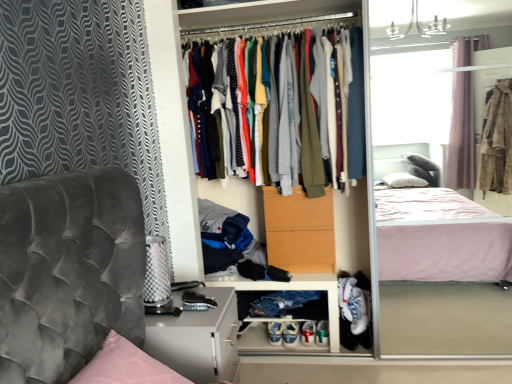
Where is `free space above matte gray cabinet at lower left (from a real-world perspective)`? The height and width of the screenshot is (384, 512). free space above matte gray cabinet at lower left (from a real-world perspective) is located at coordinates (190, 304).